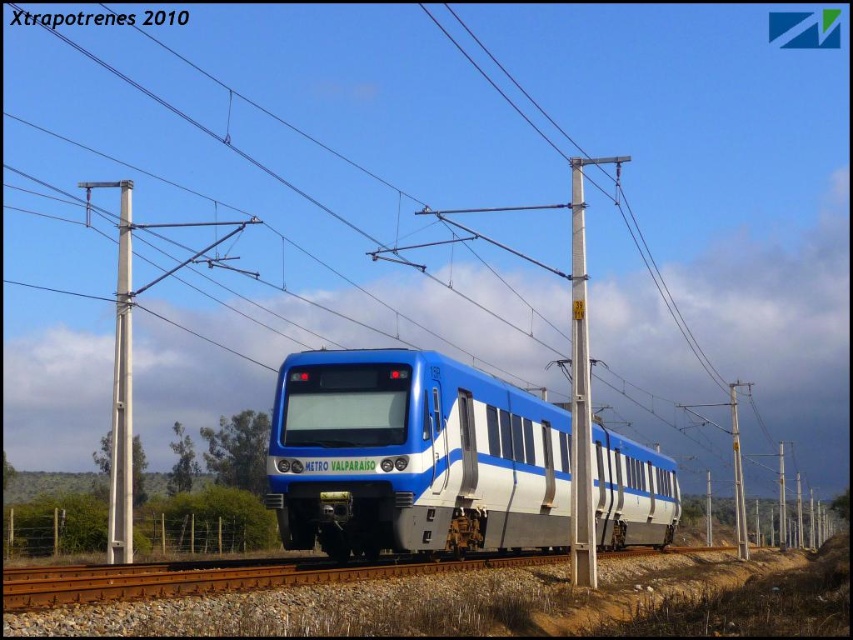
Describe the element at coordinates (120, 394) in the screenshot. I see `white metallic pole at left` at that location.

Is white metallic pole at left taller than white plastic pole at center?

Indeed, white metallic pole at left has a greater height compared to white plastic pole at center.

Is point (115, 561) positioned before point (741, 492)?

Yes.

Where is `white metallic pole at left`? This screenshot has height=640, width=853. white metallic pole at left is located at coordinates (120, 394).

Can you confirm if blue glossy train at center is positioned to the right of white metallic pole at left?

Correct, you'll find blue glossy train at center to the right of white metallic pole at left.

Who is taller, blue glossy train at center or white metallic pole at left?

white metallic pole at left is taller.

Find the location of a particular element. Image resolution: width=853 pixels, height=640 pixels. blue glossy train at center is located at coordinates (413, 456).

Is point (581, 472) less distant than point (732, 436)?

That is True.

Locate an element on the screen. The height and width of the screenshot is (640, 853). metallic gray pole at center-right is located at coordinates (579, 396).